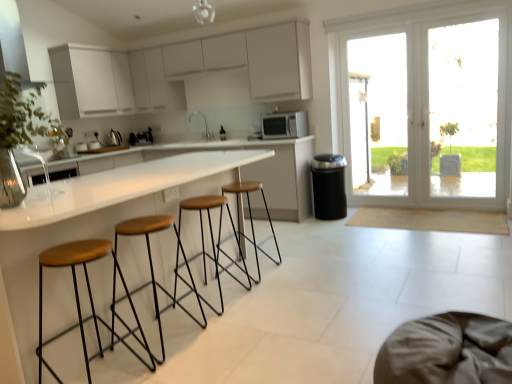
Identify the location of vacant area that is situated to the right of brown leather stool at center, acting as the third stool starting from the front. (271, 296).